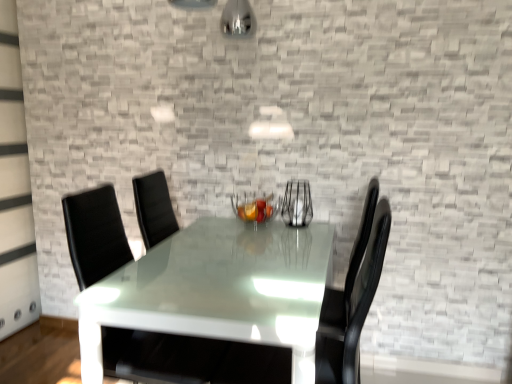
This screenshot has height=384, width=512. Identify the location of free space in front of metallic wire basket at center. (246, 238).